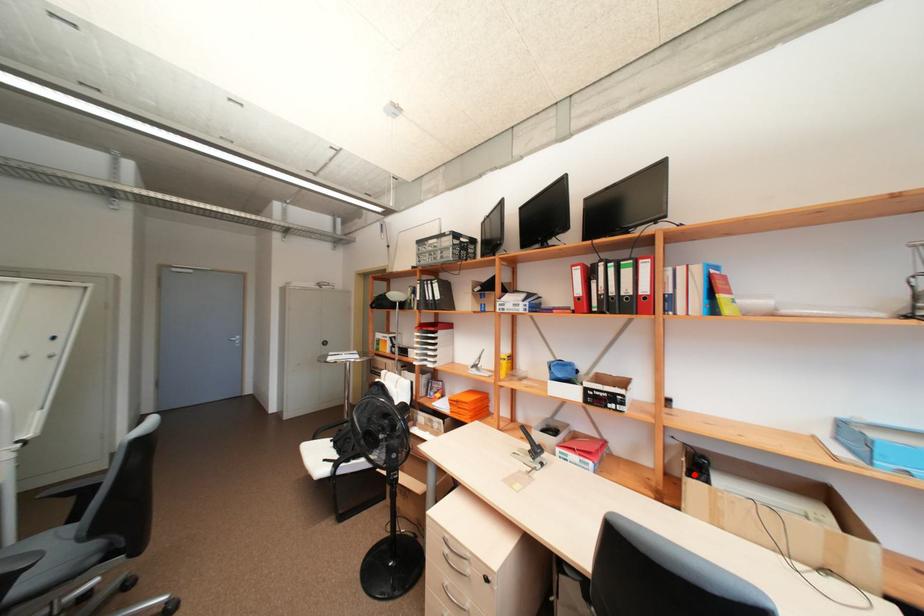
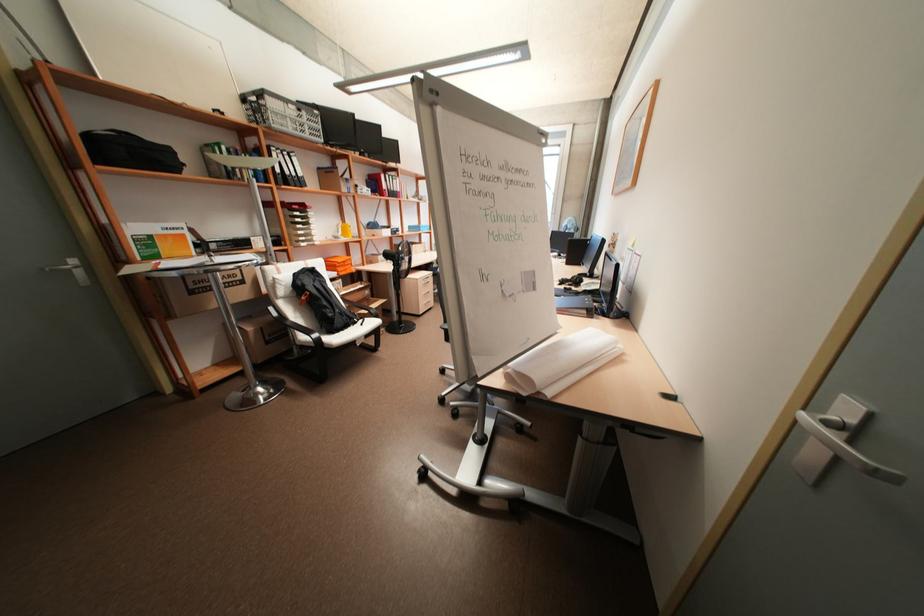
Question: I am providing you with two images of the same scene from different viewpoints. A red point is marked on the first image. At the location where the point appears in image 1, is it still visible in image 2?

Choices:
 (A) Yes
 (B) No

Answer: (B)